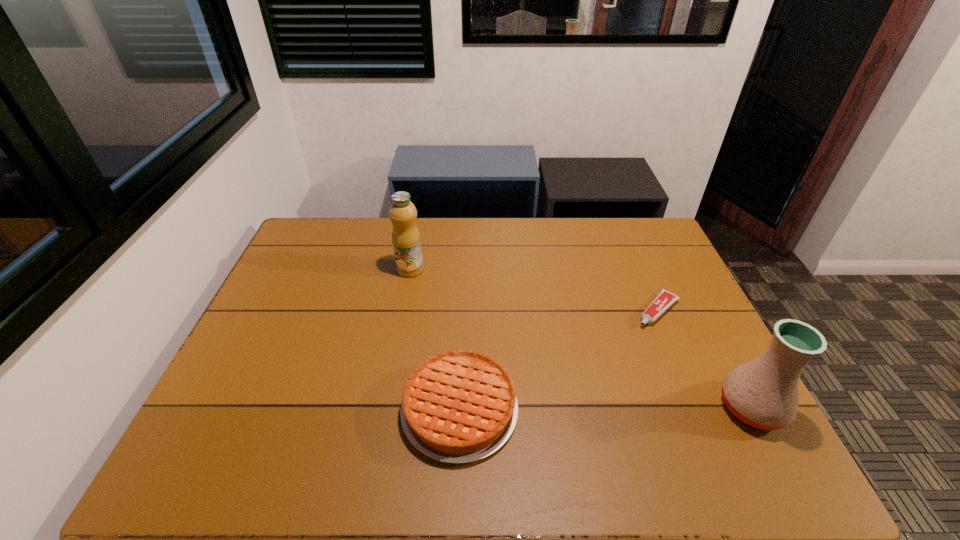
Identify the location of pie. Image resolution: width=960 pixels, height=540 pixels. (459, 406).

Image resolution: width=960 pixels, height=540 pixels. I want to click on pottery, so click(x=764, y=393).

You are a GUI agent. You are given a task and a screenshot of the screen. Output one action in this format:
    pyautogui.click(x=<x>, y=<y>)
    Task: Click on the toothpaste
    The image size is (960, 540).
    Given the screenshot: What is the action you would take?
    pyautogui.click(x=665, y=299)

The width and height of the screenshot is (960, 540). I want to click on the second farthest object, so click(665, 299).

You are a GUI agent. You are given a task and a screenshot of the screen. Output one action in this format:
    pyautogui.click(x=<x>, y=<y>)
    Task: Click on the farthest object
    
    Given the screenshot: What is the action you would take?
    click(x=406, y=239)

The height and width of the screenshot is (540, 960). I want to click on free space located 0.270m on the right of the third tallest object, so [x=630, y=410].

Identify the location of vacant space located on the left of the pottery. This screenshot has width=960, height=540. (557, 407).

Where is `free space located 0.150m at the nozzle of the toothpaste`? The height and width of the screenshot is (540, 960). free space located 0.150m at the nozzle of the toothpaste is located at coordinates (x=618, y=353).

Find the location of a particular element. This screenshot has height=540, width=960. vacant area situated at the nozzle of the toothpaste is located at coordinates (585, 389).

Where is `free space located 0.380m at the nozzle of the toothpaste`? This screenshot has height=540, width=960. free space located 0.380m at the nozzle of the toothpaste is located at coordinates (568, 407).